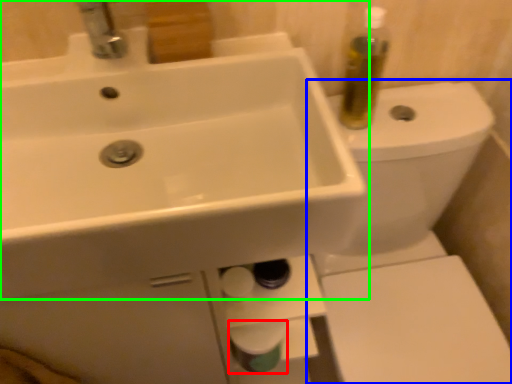
Question: Based on their relative distances, which object is farther from toilet paper (highlighted by a red box)? Choose from toilet (highlighted by a blue box) and sink (highlighted by a green box).

Choices:
 (A) toilet
 (B) sink

Answer: (B)